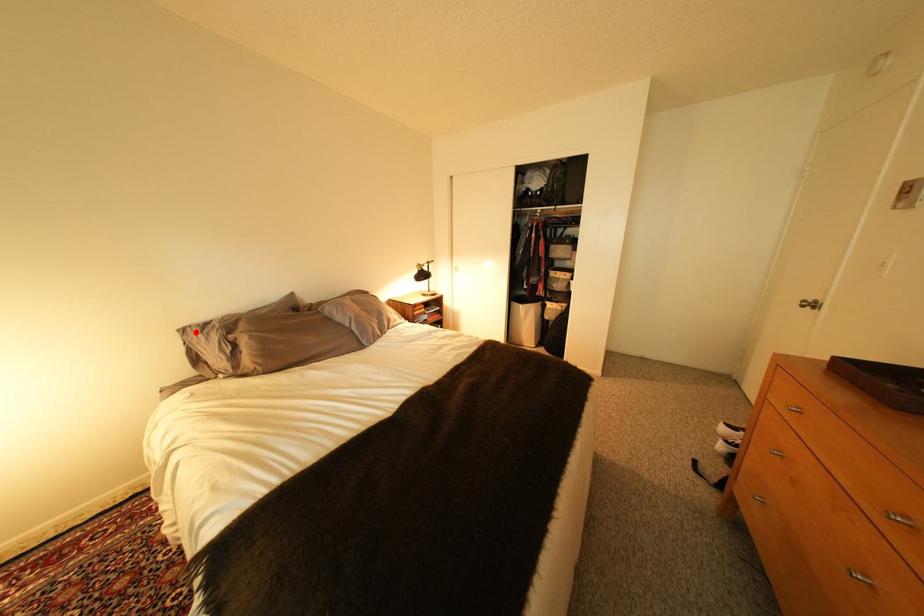
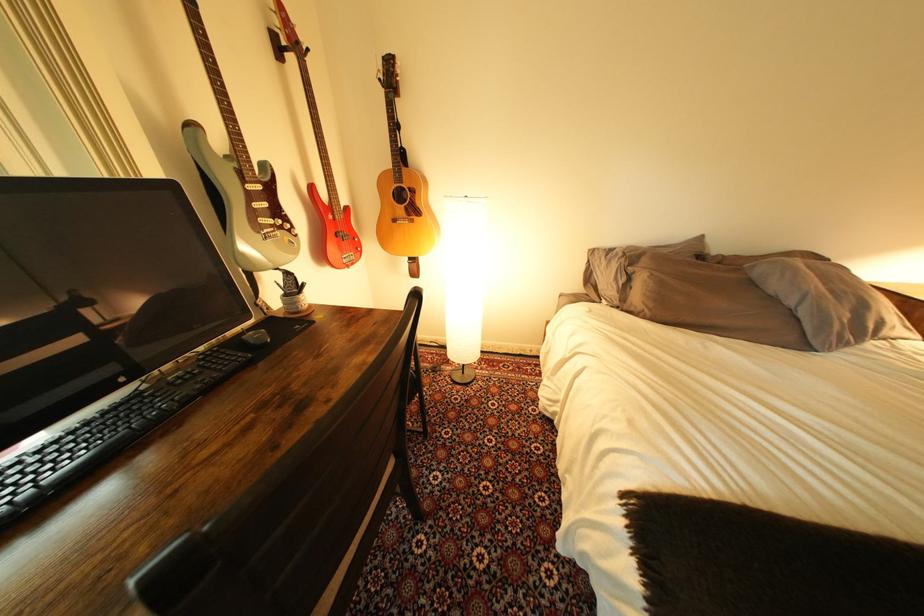
In the second image, find the point that corresponds to the highlighted location in the first image.

(604, 253)